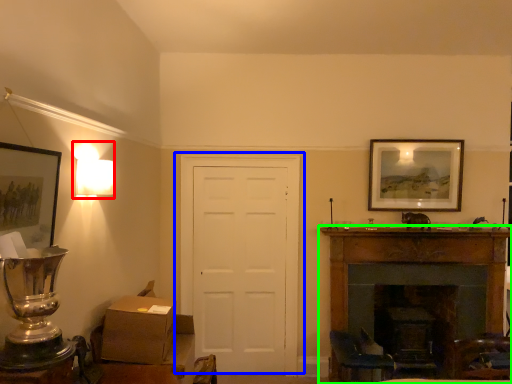
Question: Which object is the farthest from lamp (highlighted by a red box)? Choose among these: door (highlighted by a blue box) or fireplace (highlighted by a green box).

Choices:
 (A) door
 (B) fireplace

Answer: (B)